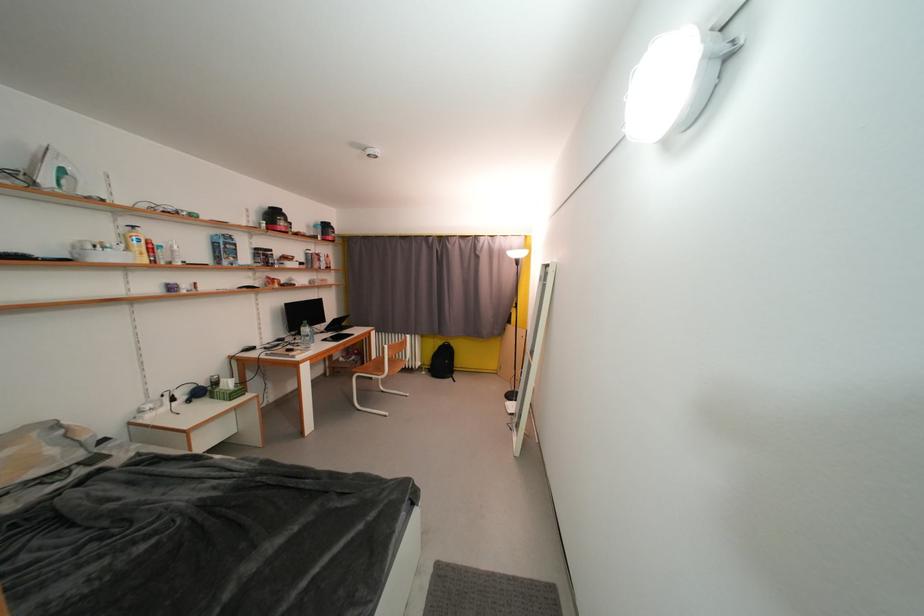
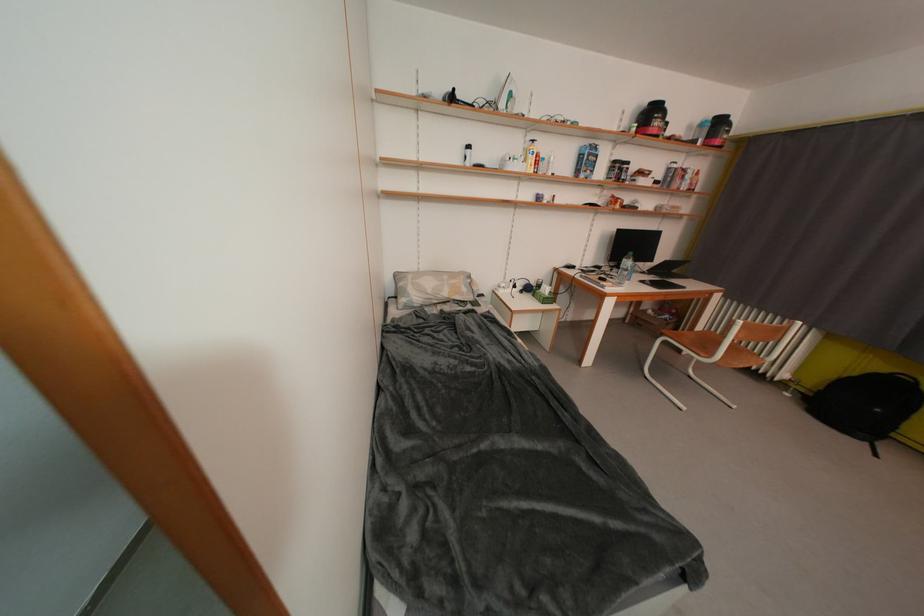
In the second image, find the point that corresponds to the point at 381,360 in the first image.

(708, 331)